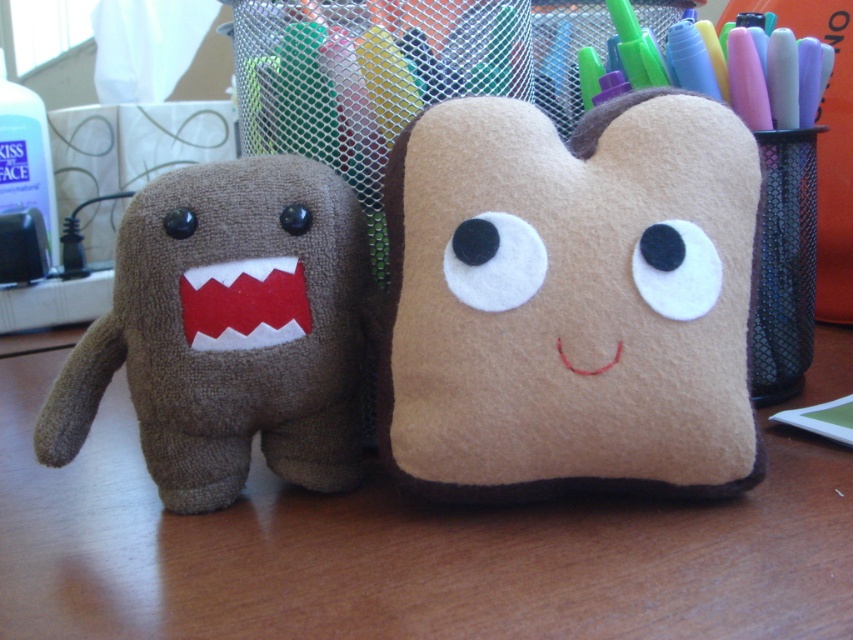
Is felt plushie at center to the right of brown plush toy at left from the viewer's perspective?

Correct, you'll find felt plushie at center to the right of brown plush toy at left.

This screenshot has width=853, height=640. What do you see at coordinates (572, 298) in the screenshot?
I see `felt plushie at center` at bounding box center [572, 298].

Locate an element on the screen. The height and width of the screenshot is (640, 853). felt plushie at center is located at coordinates (572, 298).

Who is more distant from viewer, (x=514, y=397) or (x=22, y=173)?

The point (x=22, y=173) is more distant.

Find the location of `felt plushie at center`. felt plushie at center is located at coordinates (572, 298).

Which is below, brown plush toy at left or clear plastic bottle at left?

Positioned lower is brown plush toy at left.

Is point (167, 228) closer to viewer compared to point (39, 129)?

Yes, point (167, 228) is closer to viewer.

The image size is (853, 640). Describe the element at coordinates (229, 332) in the screenshot. I see `brown plush toy at left` at that location.

Find the location of a particular element. This screenshot has height=640, width=853. brown plush toy at left is located at coordinates (229, 332).